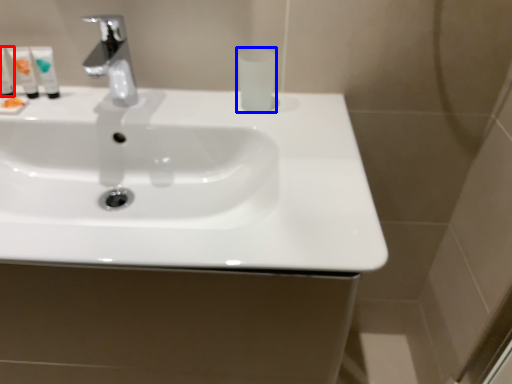
Question: Which object appears closest to the camera in this image, mouthwash (highlighted by a red box) or mouthwash (highlighted by a blue box)?

Choices:
 (A) mouthwash
 (B) mouthwash

Answer: (B)